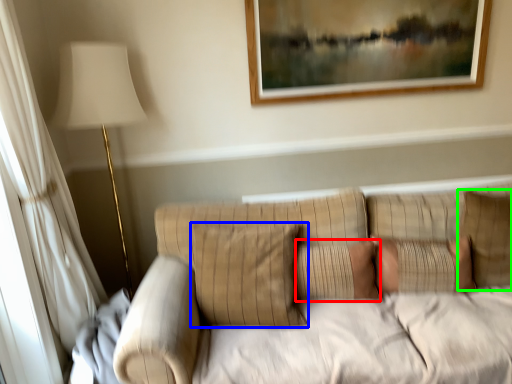
Question: Estimate the real-world distances between objects in this image. Which object is closer to pillow (highlighted by a red box), pillow (highlighted by a blue box) or pillow (highlighted by a green box)?

Choices:
 (A) pillow
 (B) pillow

Answer: (A)